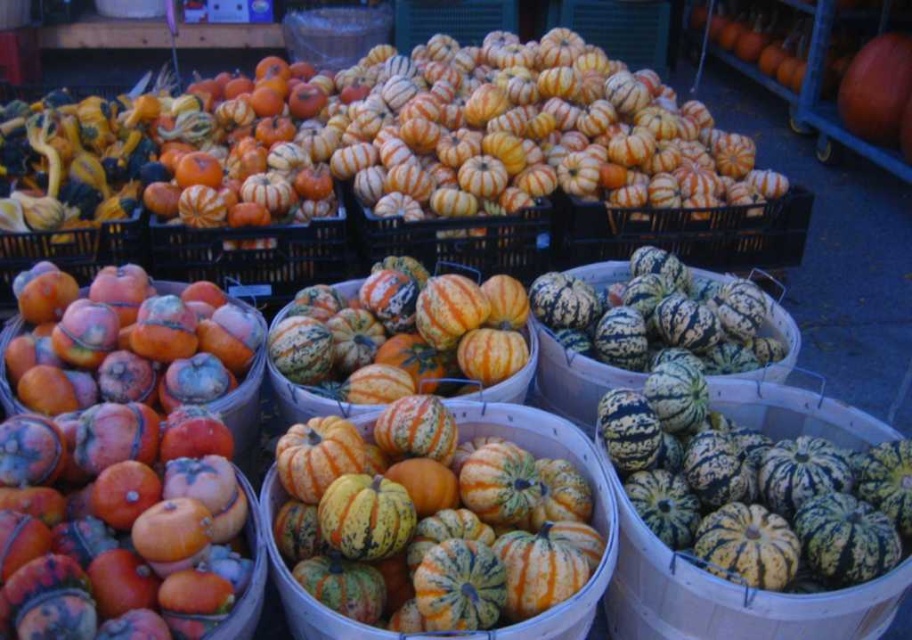
Between green speckled squash at center and green striped gourd at center, which one appears on the right side from the viewer's perspective?

green speckled squash at center is more to the right.

Who is lower down, green speckled squash at center or green striped gourd at center?

green speckled squash at center is below.

I want to click on green speckled squash at center, so click(x=755, y=490).

Who is shorter, green speckled squash at center or speckled orange gourd at center?

green speckled squash at center is shorter.

Between green speckled squash at center and speckled orange gourd at center, which one appears on the left side from the viewer's perspective?

Positioned to the left is speckled orange gourd at center.

Does point (758, 588) come farther from viewer compared to point (553, 609)?

Yes, it is.

The height and width of the screenshot is (640, 912). I want to click on green speckled squash at center, so click(755, 490).

Which of these two, green striped gourd at center or speckled orange gourd at center, stands taller?

speckled orange gourd at center is taller.

Who is lower down, green striped gourd at center or speckled orange gourd at center?

speckled orange gourd at center is below.

Where is `green striped gourd at center`? green striped gourd at center is located at coordinates (659, 316).

At what (x,y) coordinates should I click in order to perform the action: click on green striped gourd at center. Please return your answer as a coordinate pair (x, y). The image size is (912, 640). Looking at the image, I should click on (659, 316).